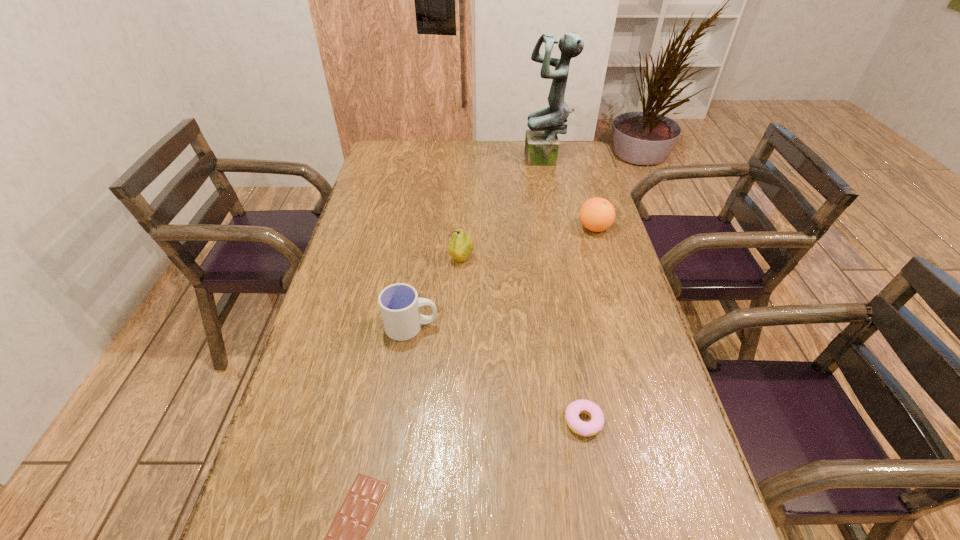
Where is `the farthest object`? This screenshot has height=540, width=960. the farthest object is located at coordinates (541, 141).

The height and width of the screenshot is (540, 960). In order to click on sculpture in this screenshot , I will do `click(541, 141)`.

Where is `the third farthest object`? the third farthest object is located at coordinates (460, 247).

Where is `pear`? pear is located at coordinates (460, 247).

Where is `the third nearest object`? the third nearest object is located at coordinates (399, 304).

Identify the location of the second farthest object. (597, 214).

At what (x,y) coordinates should I click in order to perform the action: click on doughnut. Please return your answer as a coordinate pair (x, y). The image size is (960, 540). Looking at the image, I should click on (575, 408).

Locate an element on the screen. The width and height of the screenshot is (960, 540). the fifth farthest object is located at coordinates (575, 408).

Find the location of `vacant space located 0.190m on the face of the tallest object`. vacant space located 0.190m on the face of the tallest object is located at coordinates (477, 160).

This screenshot has width=960, height=540. I want to click on free region located on the face of the tallest object, so click(445, 160).